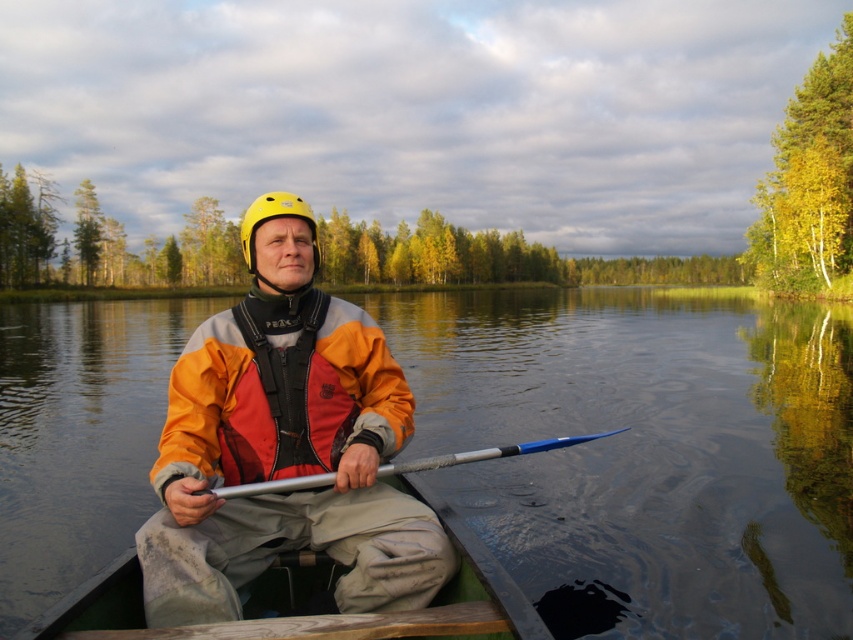
Which is above, orange fabric life jacket at center or yellow matte helmet at center?

yellow matte helmet at center

Find the location of a particular element. Image resolution: width=853 pixels, height=640 pixels. orange fabric life jacket at center is located at coordinates (285, 444).

Looking at this image, does wooden canoe at center lie in front of silver metallic paddle at center?

That is True.

Is wooden canoe at center behind silver metallic paddle at center?

No.

At what (x,y) coordinates should I click in order to perform the action: click on wooden canoe at center. Please return your answer as a coordinate pair (x, y). Image resolution: width=853 pixels, height=640 pixels. Looking at the image, I should click on (318, 589).

Does orange matte jacket at center have a smaller size compared to silver metallic paddle at center?

Incorrect, orange matte jacket at center is not smaller in size than silver metallic paddle at center.

Is point (337, 449) positioned before point (428, 465)?

No, (337, 449) is behind (428, 465).

Is point (294, 384) positioned after point (328, 480)?

Yes, point (294, 384) is behind point (328, 480).

This screenshot has width=853, height=640. Find the location of `orange matte jacket at center`. orange matte jacket at center is located at coordinates (280, 394).